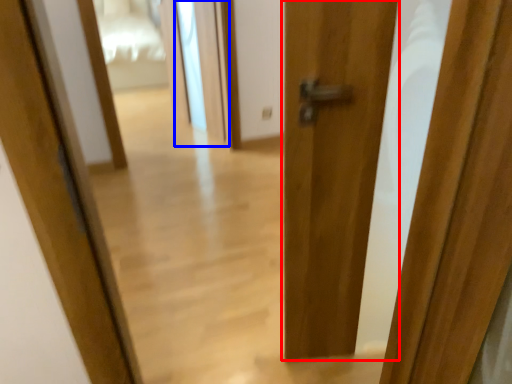
Question: Which of the following is the farthest to the observer, door (highlighted by a red box) or screen door (highlighted by a blue box)?

Choices:
 (A) door
 (B) screen door

Answer: (B)